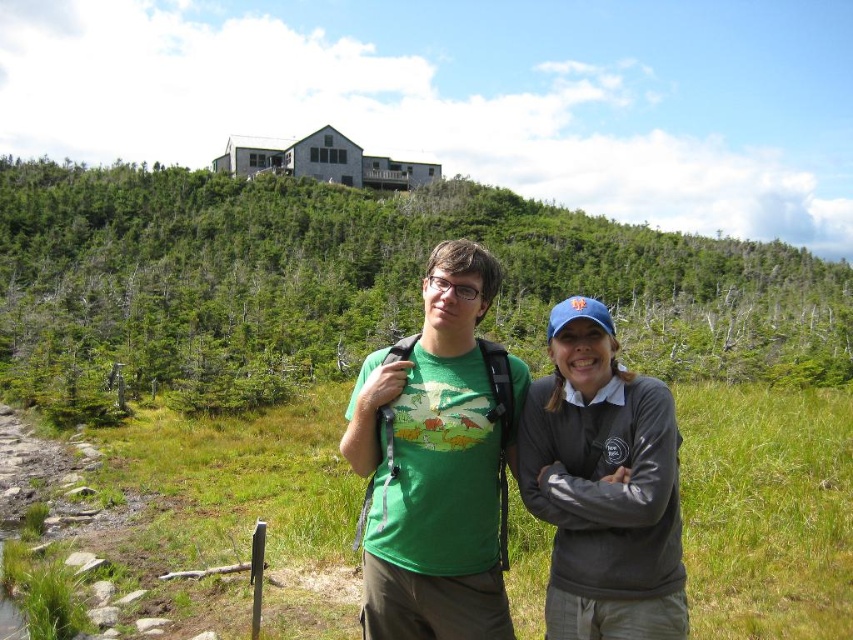
Question: Does green leafy hillside at upper center have a larger size compared to green matte t-shirt at center?

Choices:
 (A) yes
 (B) no

Answer: (A)

Question: Which object appears farthest from the camera in this image?

Choices:
 (A) green leafy hillside at upper center
 (B) green matte t-shirt at center

Answer: (A)

Question: Which of these objects is positioned farthest from the green leafy hillside at upper center?

Choices:
 (A) green matte t-shirt at center
 (B) gray fleece jacket at center

Answer: (B)

Question: Is gray fleece jacket at center thinner than green matte t-shirt at center?

Choices:
 (A) no
 (B) yes

Answer: (B)

Question: Considering the real-world distances, which object is farthest from the green leafy hillside at upper center?

Choices:
 (A) gray fleece jacket at center
 (B) green matte t-shirt at center

Answer: (A)

Question: Does green leafy hillside at upper center appear under green matte t-shirt at center?

Choices:
 (A) no
 (B) yes

Answer: (A)